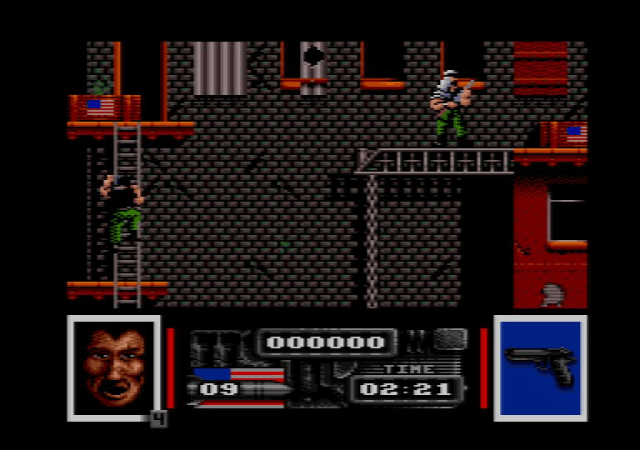
Where is `window`? Image resolution: width=640 pixels, height=450 pixels. window is located at coordinates (292, 61), (376, 51), (458, 51), (566, 224).